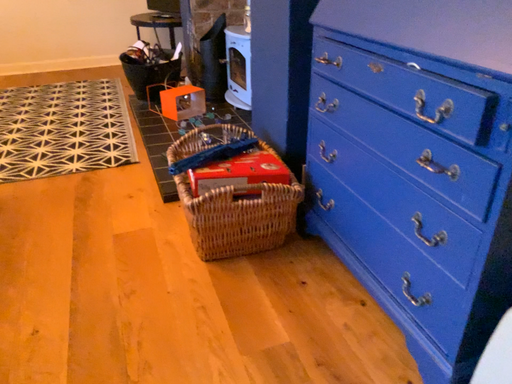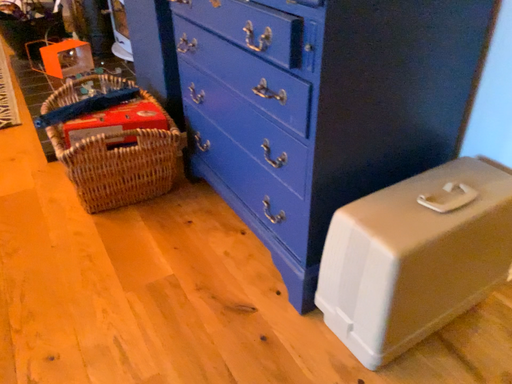
Question: How did the camera likely rotate when shooting the video?

Choices:
 (A) rotated left
 (B) rotated right

Answer: (B)